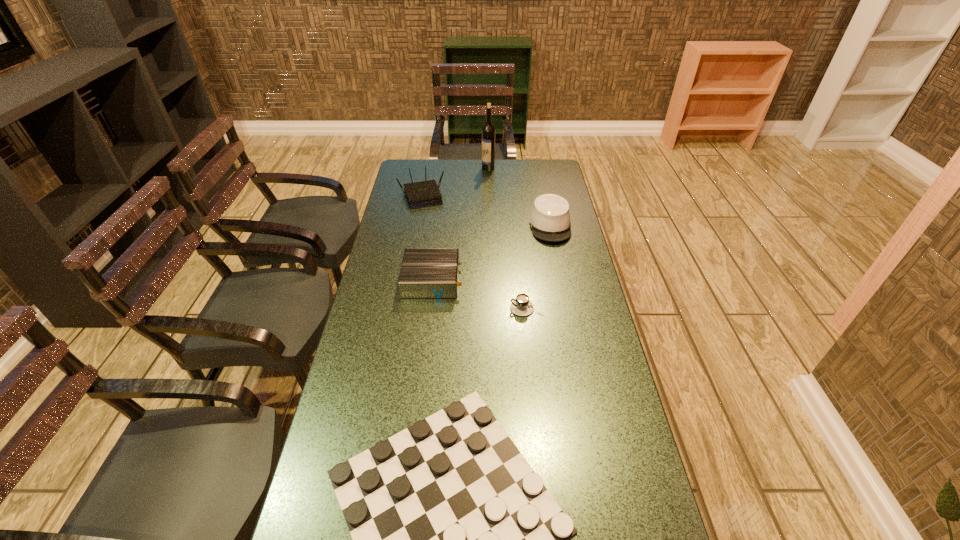
Locate an element on the screen. This screenshot has height=540, width=960. empty space that is in between the taller router and the nearer router is located at coordinates (426, 238).

Find the location of a particular element. The width and height of the screenshot is (960, 540). vacant space that's between the second nearest object and the farther router is located at coordinates (473, 252).

This screenshot has width=960, height=540. I want to click on object identified as the fifth closest to the hat, so click(x=456, y=539).

You are a GUI agent. You are given a task and a screenshot of the screen. Output one action in this format:
    pyautogui.click(x=<x>, y=<y>)
    Task: Click on the object that is the fourth closest to the hat
    The height and width of the screenshot is (540, 960).
    Given the screenshot: What is the action you would take?
    pyautogui.click(x=422, y=194)

Where is `free space that satisfies the following two spatial constraints: 1. on the front-facing side of the hat; 2. on the back panel of the nearer router`? The height and width of the screenshot is (540, 960). free space that satisfies the following two spatial constraints: 1. on the front-facing side of the hat; 2. on the back panel of the nearer router is located at coordinates (562, 280).

Find the location of `vacant space that satisfies the following two spatial constraints: 1. on the front-facing side of the hat; 2. on the back panel of the third shortest object`. vacant space that satisfies the following two spatial constraints: 1. on the front-facing side of the hat; 2. on the back panel of the third shortest object is located at coordinates (562, 280).